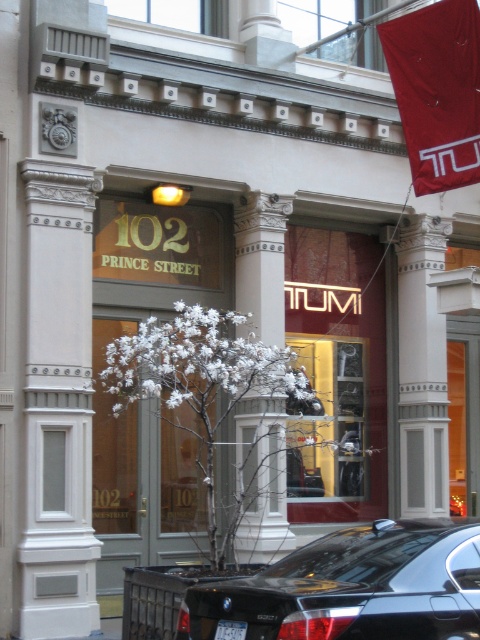
You are a driver approaching the building at 102 Prince Street. You see the black glossy car at lower center and the white marble column at center. Which object is closer to the entrance of the building?

The black glossy car at lower center is positioned on the left side of the white marble column at center, so the car is closer to the entrance than the column.

You are a delivery driver who needs to park your truck near the white plastic license plate at lower center. The truck is 20 feet long. There is a red fabric flag at upper right nearby. Can you safely park your truck without hitting the flag?

The red fabric flag at upper right is 25.33 feet away from the white plastic license plate at lower center. Since the truck is 20 feet long, there is enough space between them to park safely without hitting the flag.

You are a pedestrian standing in front of the building at 102 Prince Street. You see a black glossy car at lower center and a white marble column at center. Which object is closer to the entrance of the building?

The black glossy car at lower center is closer to the entrance of the building because it is positioned below the white marble column at center, which places it nearer to the entrance area.